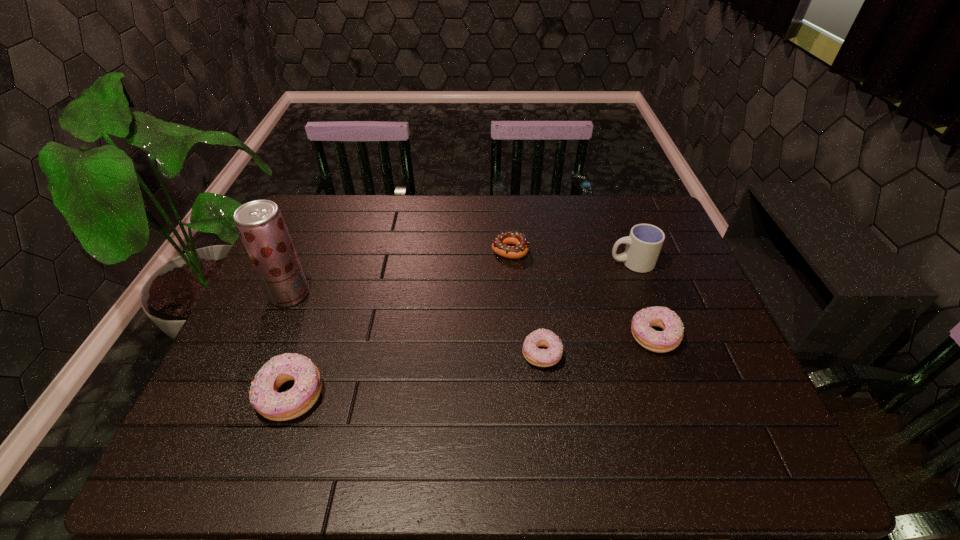
You are a GUI agent. You are given a task and a screenshot of the screen. Output one action in this format:
    pyautogui.click(x=<x>, y=<y>)
    Task: Click on the vacant space that is in between the cup and the rightmost doughnut
    
    Given the screenshot: What is the action you would take?
    pyautogui.click(x=642, y=300)

The width and height of the screenshot is (960, 540). Find the location of `free space that is in between the farthest doughnut and the second tallest object`. free space that is in between the farthest doughnut and the second tallest object is located at coordinates (571, 256).

This screenshot has height=540, width=960. Find the location of `object that stands as the fifth closest to the farthest doughnut`. object that stands as the fifth closest to the farthest doughnut is located at coordinates (264, 397).

Where is `the second closest object to the farthest doughnut`? Image resolution: width=960 pixels, height=540 pixels. the second closest object to the farthest doughnut is located at coordinates (542, 337).

Select which doughnut is the third closest to the tallest doughnut. Please provide its 2D coordinates. Your answer should be formatted as a tuple, i.e. [(x, y)], where the tuple contains the x and y coordinates of a point satisfying the conditions above.

[(667, 340)]

Identify which doughnut is the third nearest to the farthest doughnut. Please provide its 2D coordinates. Your answer should be formatted as a tuple, i.e. [(x, y)], where the tuple contains the x and y coordinates of a point satisfying the conditions above.

[(264, 397)]

This screenshot has width=960, height=540. I want to click on blank space that satisfies the following two spatial constraints: 1. on the front side of the fourth nearest object; 2. on the left side of the rightmost doughnut, so click(272, 336).